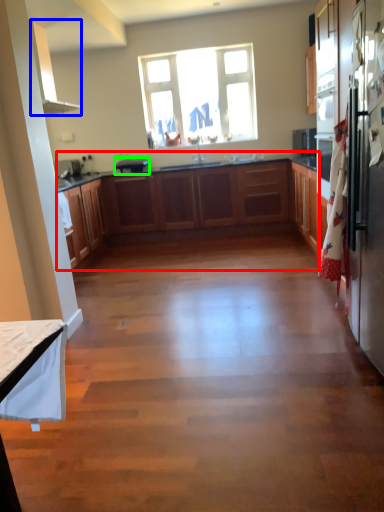
Question: Based on their relative distances, which object is farther from cabinetry (highlighted by a red box)? Choose from exhaust hood (highlighted by a blue box) and appliance (highlighted by a green box).

Choices:
 (A) exhaust hood
 (B) appliance

Answer: (A)